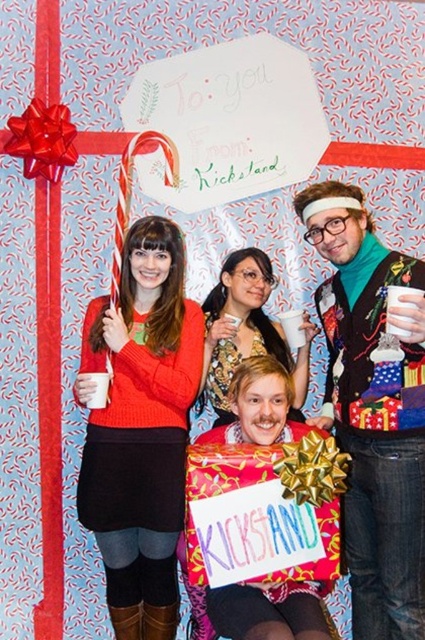
You are organizing a holiday gift wrapping station and need to place two sweaters from the group photo into boxes. The matte orange sweater at center and the velvet teal sweater at center must be packed. Based on their positions in the photo, which sweater should you place into the left box if the boxes are arranged in the same order as the sweaters in the image?

The matte orange sweater at center should be placed into the left box because it is positioned on the left side of the velvet teal sweater at center in the image.

You are a photographer trying to focus on the matte orange sweater at center and the velvet teal sweater at center in the group photo. Which sweater should you adjust your camera lens to focus on first if you want to capture both clearly?

The matte orange sweater at center is closer to the viewer than the velvet teal sweater at center, so you should focus on the matte orange sweater at center first to ensure both are in focus.

You are a photographer trying to adjust the lighting for a group photo. You notice two sweaters in the center of the image, a matte orange sweater at center and a matte black sweater at center. Which sweater is closer to the bottom of the image?

The matte orange sweater at center is positioned under the matte black sweater at center, so it is closer to the bottom of the image.